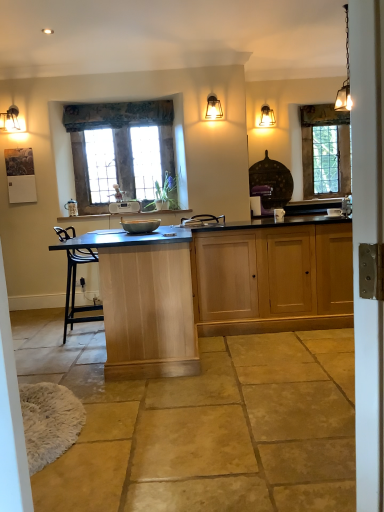
Question: Which is correct: white plastic radio at center is inside wooden-framed window at center, which appears as the first window when viewed from the front, or outside of it?

Choices:
 (A) inside
 (B) outside

Answer: (B)

Question: In the image, is white plastic radio at center positioned in front of or behind wooden-framed window at center, which is the second window from right to left?

Choices:
 (A) behind
 (B) front

Answer: (B)

Question: Which is farther from the matte glass lamp at upper center, the third lamp viewed from the right?

Choices:
 (A) light wood table at center
 (B) clear glass window at upper right, the second window from the front
 (C) white glossy door at right
 (D) matte gray bowl at center
 (E) white plastic radio at center

Answer: (C)

Question: Considering the real-world distances, which object is farthest from the matte glass pendant light at upper right, which is the 3th lamp from left to right?

Choices:
 (A) light wood cabinet at center
 (B) white plastic radio at center
 (C) wooden-framed window at center, which appears as the first window when viewed from the front
 (D) light wood table at center
 (E) clear glass window at upper right, the first window viewed from the back

Answer: (D)